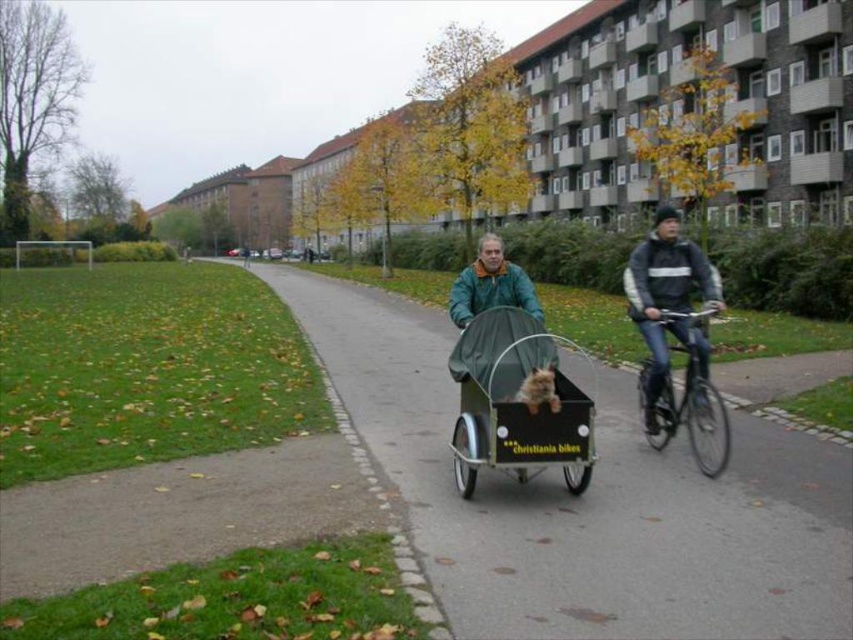
Question: Among these objects, which one is nearest to the camera?

Choices:
 (A) dark gray jacket at center right
 (B) green fabric cart at center

Answer: (B)

Question: Which point is closer to the camera?

Choices:
 (A) (704, 461)
 (B) (659, 308)

Answer: (A)

Question: Does green fabric baby carriage at center have a greater width compared to dark gray jacket at center right?

Choices:
 (A) no
 (B) yes

Answer: (A)

Question: Does green fabric cart at center come behind shiny black bicycle at center right?

Choices:
 (A) yes
 (B) no

Answer: (B)

Question: Does green fabric baby carriage at center appear under green matte jacket at center?

Choices:
 (A) yes
 (B) no

Answer: (A)

Question: Which object is closer to the camera taking this photo?

Choices:
 (A) green matte jacket at center
 (B) dark gray jacket at center right
 (C) shiny black bicycle at center right
 (D) green fabric cart at center

Answer: (D)